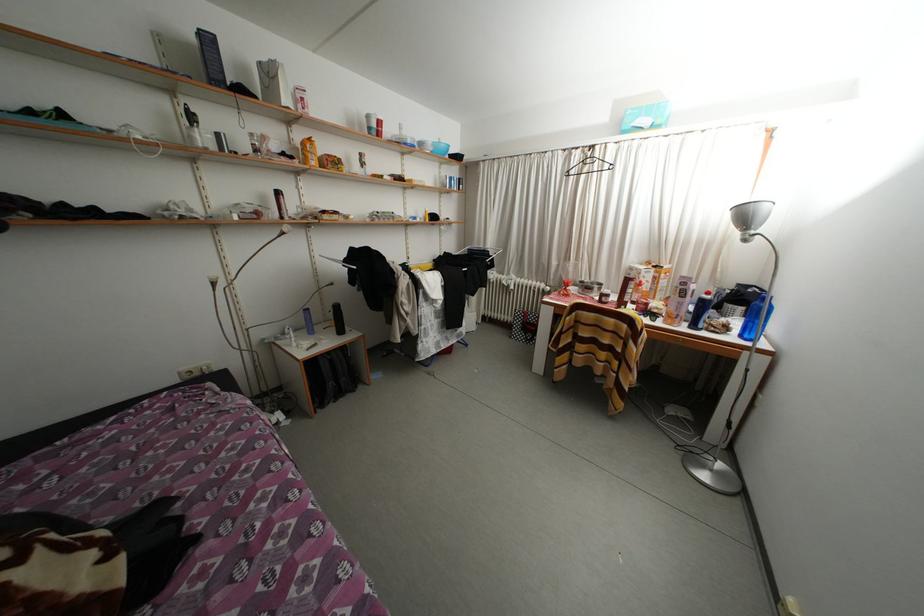
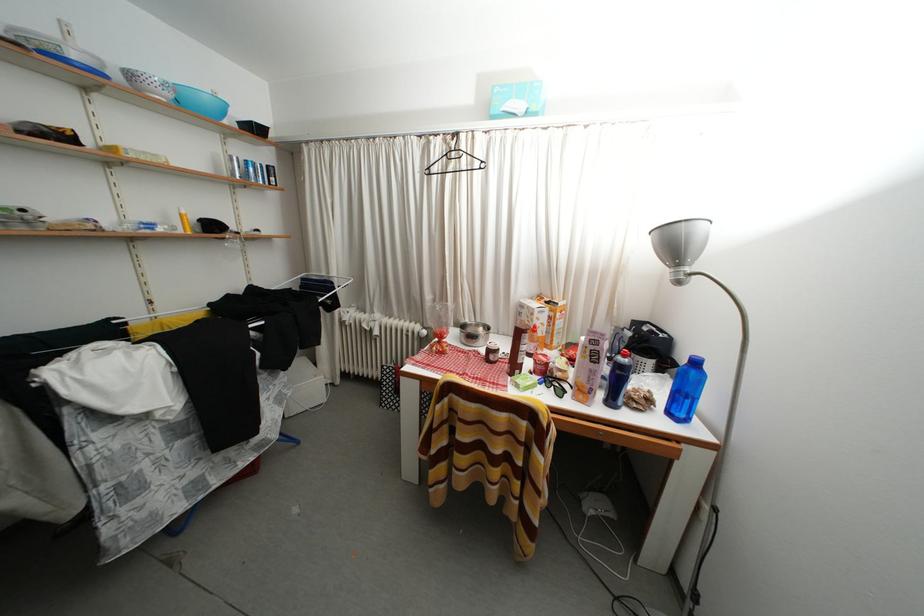
The images are taken continuously from a first-person perspective. In which direction are you moving?

The cameraman walked toward right, forward.